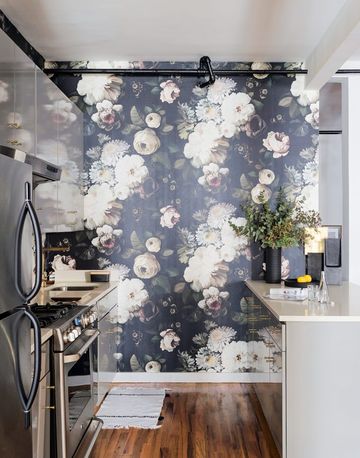
Where is `oven door`? This screenshot has height=458, width=360. oven door is located at coordinates (83, 380).